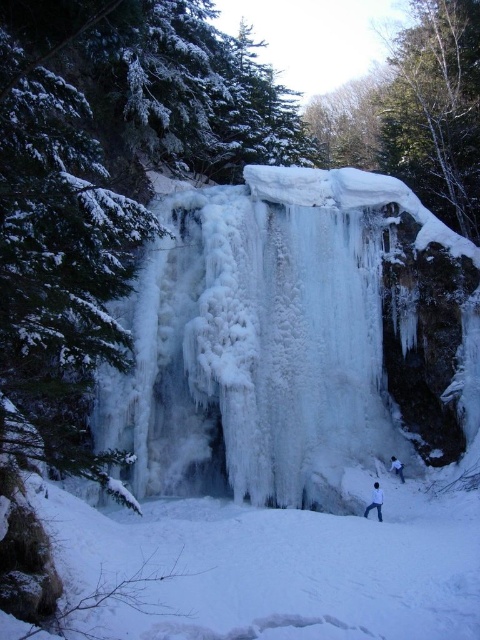
Who is more distant from viewer, (373, 497) or (404, 480)?

The point (404, 480) is more distant.

Who is shorter, white matte jacket at lower center or gray fabric skier at lower right?

Standing shorter between the two is gray fabric skier at lower right.

The height and width of the screenshot is (640, 480). Identify the location of white matte jacket at lower center. (375, 500).